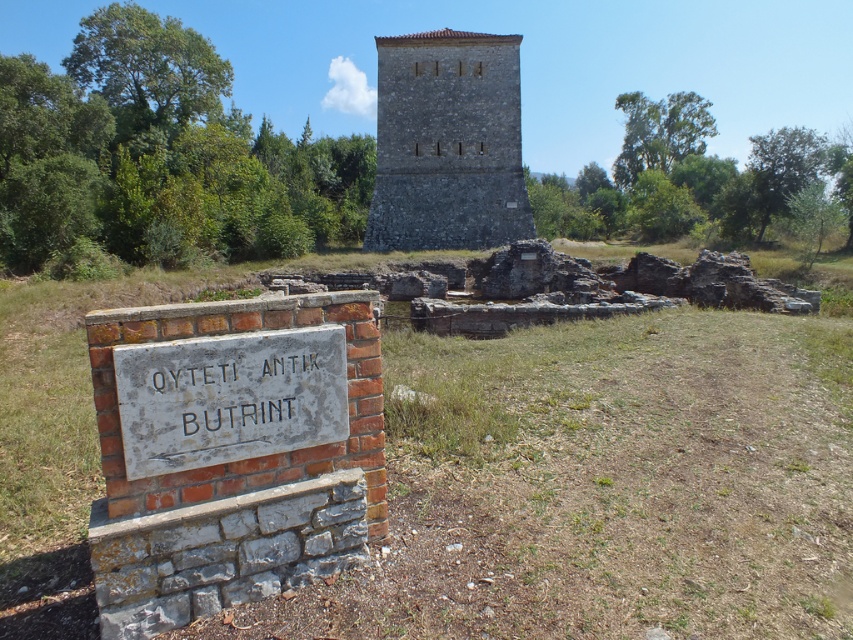
Which of these two, white stone sign at lower left or white stone sign at center, stands taller?

With more height is white stone sign at lower left.

Describe the element at coordinates (229, 396) in the screenshot. The height and width of the screenshot is (640, 853). I see `white stone sign at lower left` at that location.

Between point (334, 413) and point (236, 428), which one is positioned in front?

Point (236, 428) is more forward.

Where is `white stone sign at lower left`? The height and width of the screenshot is (640, 853). white stone sign at lower left is located at coordinates (229, 396).

Which is in front, point (103, 458) or point (294, 401)?

Positioned in front is point (103, 458).

At what (x,y) coordinates should I click in order to perform the action: click on brick sign at lower left. Please return your answer as a coordinate pair (x, y). Looking at the image, I should click on (231, 458).

Is point (300, 317) positioned behind point (270, 403)?

Yes, point (300, 317) is behind point (270, 403).

Image resolution: width=853 pixels, height=640 pixels. What are the coordinates of `brick sign at lower left` in the screenshot? It's located at (231, 458).

Does stone tower at center appear under white stone sign at center?

Incorrect, stone tower at center is not positioned below white stone sign at center.

Is point (381, 147) farther from camera compared to point (242, 413)?

Yes, point (381, 147) is behind point (242, 413).

Which is in front, point (447, 216) or point (283, 401)?

Point (283, 401) is in front.

Identify the location of stone tower at center. (447, 144).